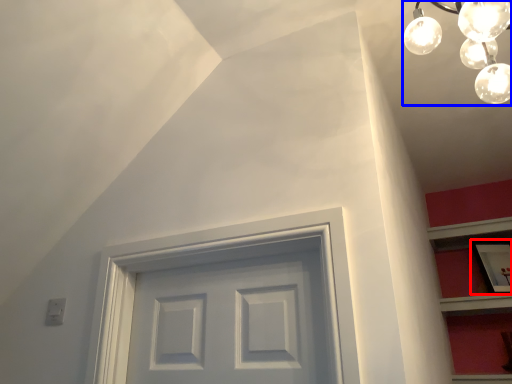
Question: Which point is closer to the camera, picture frame (highlighted by a red box) or light fixture (highlighted by a blue box)?

Choices:
 (A) picture frame
 (B) light fixture

Answer: (B)